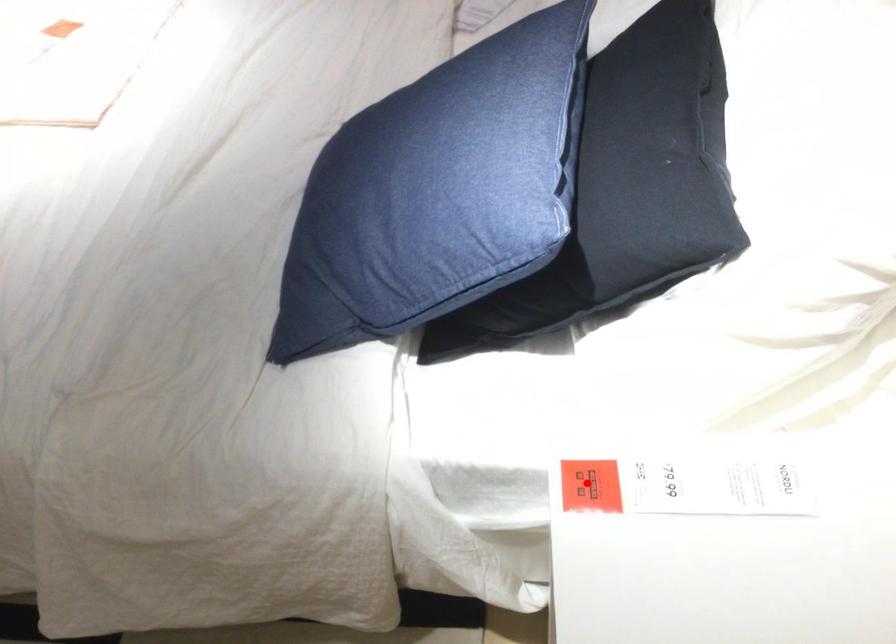
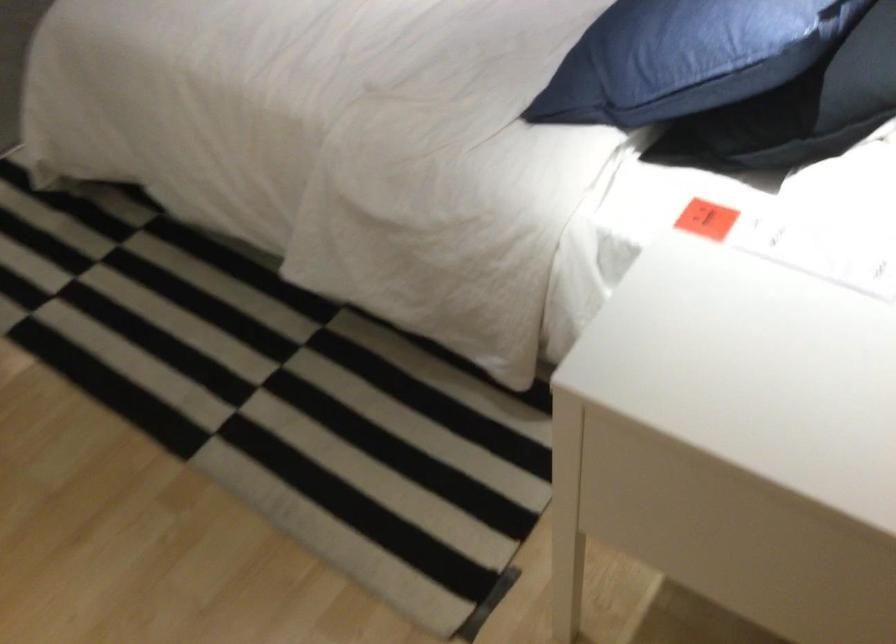
Question: I am providing you with two images of the same scene from different viewpoints. A red point is shown in image1. For the corresponding object point in image2, is it positioned nearer or farther from the camera?

Choices:
 (A) Nearer
 (B) Farther

Answer: (B)